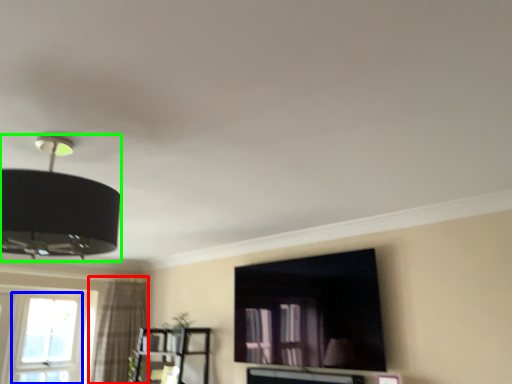
Question: Considering the real-world distances, which object is farthest from curtain (highlighted by a red box)? window (highlighted by a blue box) or lamp (highlighted by a green box)?

Choices:
 (A) window
 (B) lamp

Answer: (B)